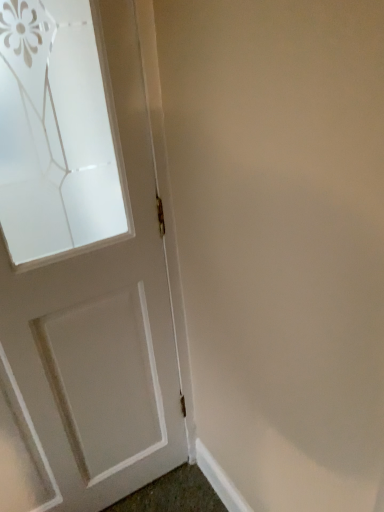
Describe the element at coordinates (83, 258) in the screenshot. I see `white painted wood door at left` at that location.

Find the location of `white painted wood door at left`. white painted wood door at left is located at coordinates (83, 258).

Where is `white smooth baseboard at lower right`? The width and height of the screenshot is (384, 512). white smooth baseboard at lower right is located at coordinates coord(219,480).

This screenshot has height=512, width=384. Describe the element at coordinates (219, 480) in the screenshot. I see `white smooth baseboard at lower right` at that location.

Find the location of `white painted wood door at left`. white painted wood door at left is located at coordinates [83, 258].

Is white painted wood door at left at the right side of white smooth baseboard at lower right?

In fact, white painted wood door at left is to the left of white smooth baseboard at lower right.

In the image, is white painted wood door at left positioned in front of or behind white smooth baseboard at lower right?

In the image, white painted wood door at left appears in front of white smooth baseboard at lower right.

Based on the photo, which point is more distant from viewer, (49, 83) or (224, 481)?

The point (224, 481) is farther from the camera.

From the image's perspective, would you say white painted wood door at left is shown under white smooth baseboard at lower right?

Actually, white painted wood door at left appears above white smooth baseboard at lower right in the image.

From a real-world perspective, between white painted wood door at left and white smooth baseboard at lower right, who is vertically lower?

In real-world perspective, white smooth baseboard at lower right is lower.

Which object is wider, white painted wood door at left or white smooth baseboard at lower right?

white painted wood door at left.

Between white painted wood door at left and white smooth baseboard at lower right, which one has less height?

white smooth baseboard at lower right is shorter.

From the picture: Which of these two, white painted wood door at left or white smooth baseboard at lower right, is bigger?

white painted wood door at left is bigger.

Is white painted wood door at left not within white smooth baseboard at lower right?

Yes, white painted wood door at left is located beyond the bounds of white smooth baseboard at lower right.

Is white painted wood door at left not near white smooth baseboard at lower right?

No, white painted wood door at left is not far from white smooth baseboard at lower right.

Is white painted wood door at left positioned with its back to white smooth baseboard at lower right?

No, white painted wood door at left is not facing the opposite direction of white smooth baseboard at lower right.

How many degrees apart are the facing directions of white painted wood door at left and white smooth baseboard at lower right?

white painted wood door at left and white smooth baseboard at lower right are facing 90 degrees away from each other.

Locate an element on the screen. molding behind the white painted wood door at left is located at coordinates (219, 480).

Which is more to the right, white smooth baseboard at lower right or white painted wood door at left?

white smooth baseboard at lower right.

Is white smooth baseboard at lower right further to camera compared to white painted wood door at left?

Yes, it is behind white painted wood door at left.

Which point is more distant from viewer, (230, 505) or (3, 428)?

The point (230, 505) is behind.

From the image's perspective, does white smooth baseboard at lower right appear higher than white painted wood door at left?

Actually, white smooth baseboard at lower right appears below white painted wood door at left in the image.

From a real-world perspective, between white smooth baseboard at lower right and white painted wood door at left, who is vertically higher?

white painted wood door at left.

Which of these two, white smooth baseboard at lower right or white painted wood door at left, is thinner?

Thinner between the two is white smooth baseboard at lower right.

Who is taller, white smooth baseboard at lower right or white painted wood door at left?

Standing taller between the two is white painted wood door at left.

Based on the photo, who is bigger, white smooth baseboard at lower right or white painted wood door at left?

white painted wood door at left.

Is white smooth baseboard at lower right situated inside white painted wood door at left or outside?

white smooth baseboard at lower right is outside white painted wood door at left.

Is white smooth baseboard at lower right far away from white painted wood door at left?

white smooth baseboard at lower right is near white painted wood door at left, not far away.

Could you tell me if white smooth baseboard at lower right is turned towards white painted wood door at left?

No, white smooth baseboard at lower right is not aimed at white painted wood door at left.

At what (x,y) coordinates should I click in order to perform the action: click on molding that is below the white painted wood door at left (from the image's perspective). Please return your answer as a coordinate pair (x, y). This screenshot has height=512, width=384. Looking at the image, I should click on (219, 480).

I want to click on door lying in front of the white smooth baseboard at lower right, so click(x=83, y=258).

Where is `door above the white smooth baseboard at lower right (from a real-world perspective)`? The width and height of the screenshot is (384, 512). door above the white smooth baseboard at lower right (from a real-world perspective) is located at coordinates (83, 258).